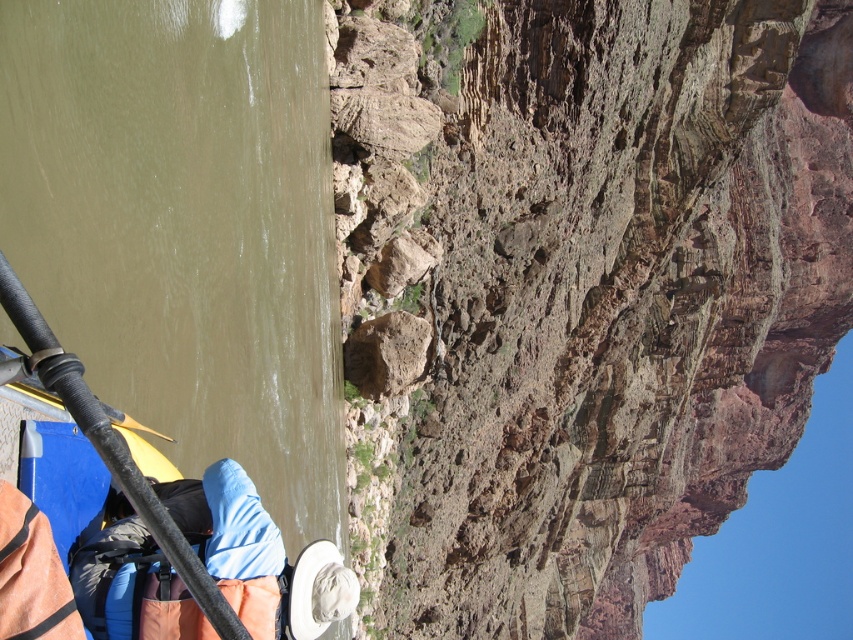
You are on a river rafting trip and notice a point marked at coordinates (576,291). What significant natural feature is located at this point?

The brown rough cliff at upper right is located at point (576,291).

You are on a river rafting trip and need to navigate around the brown rough cliff at upper right. Based on your current position, which direction should you steer the raft to avoid it?

The brown rough cliff at upper right is located at point (576, 291), so you should steer the raft to the left or downstream to avoid it.